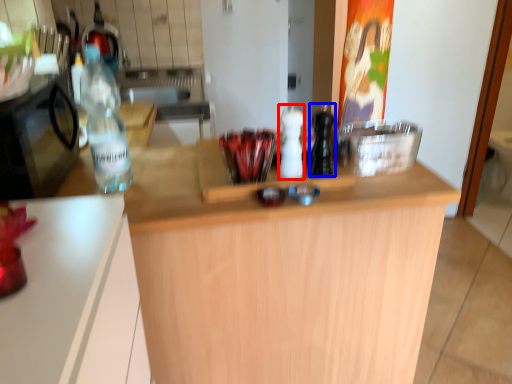
Question: Which object is closer to the camera taking this photo, bottle (highlighted by a red box) or bottle (highlighted by a blue box)?

Choices:
 (A) bottle
 (B) bottle

Answer: (B)